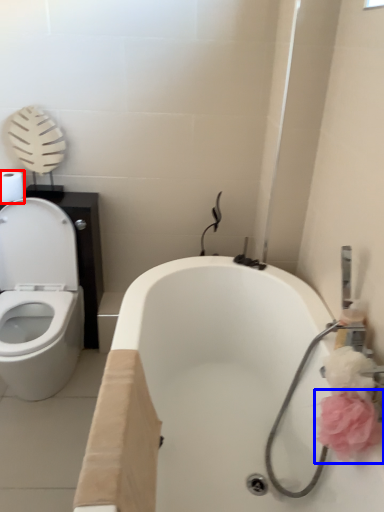
Question: Which object appears closest to the camera in this image, toilet paper (highlighted by a red box) or flower (highlighted by a blue box)?

Choices:
 (A) toilet paper
 (B) flower

Answer: (B)